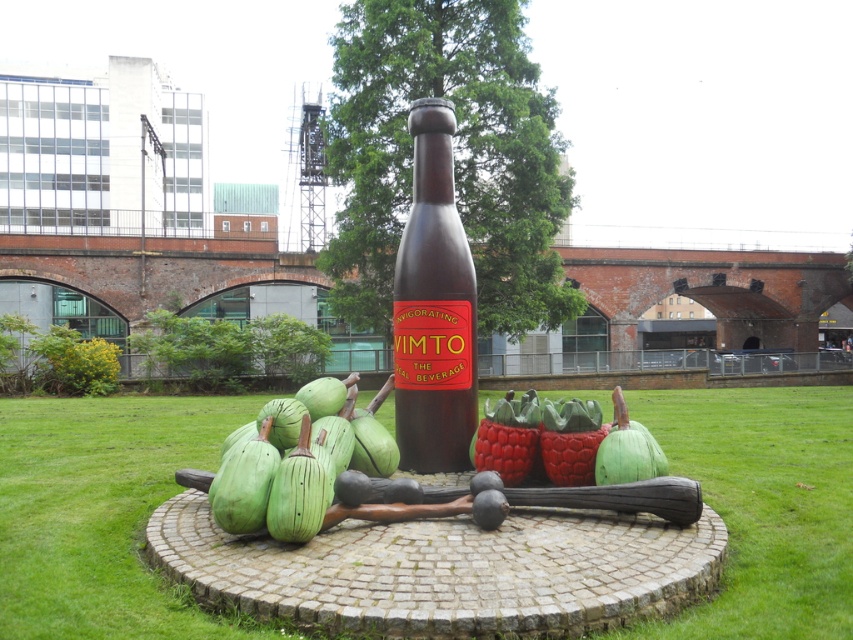
Which of these two, green grass at center or green matte gourd at center, stands shorter?

Standing shorter between the two is green grass at center.

Which is more to the right, green grass at center or green matte gourd at center?

Positioned to the right is green matte gourd at center.

Image resolution: width=853 pixels, height=640 pixels. In order to click on green grass at center in this screenshot , I will do `click(102, 513)`.

Can you confirm if green wood fruit at center is shorter than rubberized green fruit at center?

No.

Is point (247, 518) less distant than point (576, 444)?

Yes, point (247, 518) is closer to viewer.

I want to click on green wood fruit at center, so click(283, 467).

Does point (245, 522) come farther from viewer compared to point (544, 403)?

No, (245, 522) is closer to viewer.

Is green matte squash at lower left thinner than rubberized green fruit at center?

Yes, green matte squash at lower left is thinner than rubberized green fruit at center.

This screenshot has height=640, width=853. I want to click on green matte squash at lower left, so click(x=244, y=483).